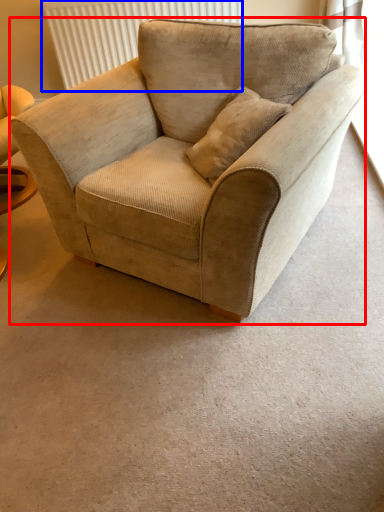
Question: Which object is closer to the camera taking this photo, chair (highlighted by a red box) or radiator (highlighted by a blue box)?

Choices:
 (A) chair
 (B) radiator

Answer: (A)